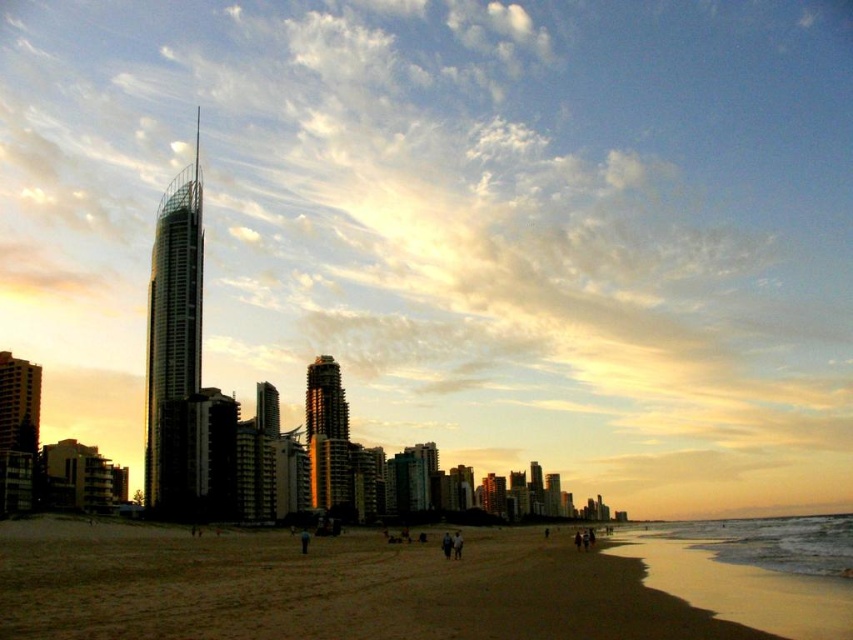
Question: Is shiny glass skyscraper at center further to camera compared to gold reflective glass tower at center?

Choices:
 (A) no
 (B) yes

Answer: (A)

Question: Which point is closer to the camera taking this photo?

Choices:
 (A) (318, 486)
 (B) (184, 269)

Answer: (A)

Question: From the image, what is the correct spatial relationship of brown sand at lower left in relation to gold reflective glass tower at center?

Choices:
 (A) below
 (B) above

Answer: (A)

Question: Which of the following is the closest to the observer?

Choices:
 (A) brown sand at lower left
 (B) shiny glass skyscraper at center
 (C) gold reflective glass tower at center

Answer: (A)

Question: Is shiny glass skyscraper at center below gold reflective glass tower at center?

Choices:
 (A) yes
 (B) no

Answer: (B)

Question: Which of the following is the closest to the observer?

Choices:
 (A) (39, 637)
 (B) (321, 433)

Answer: (A)